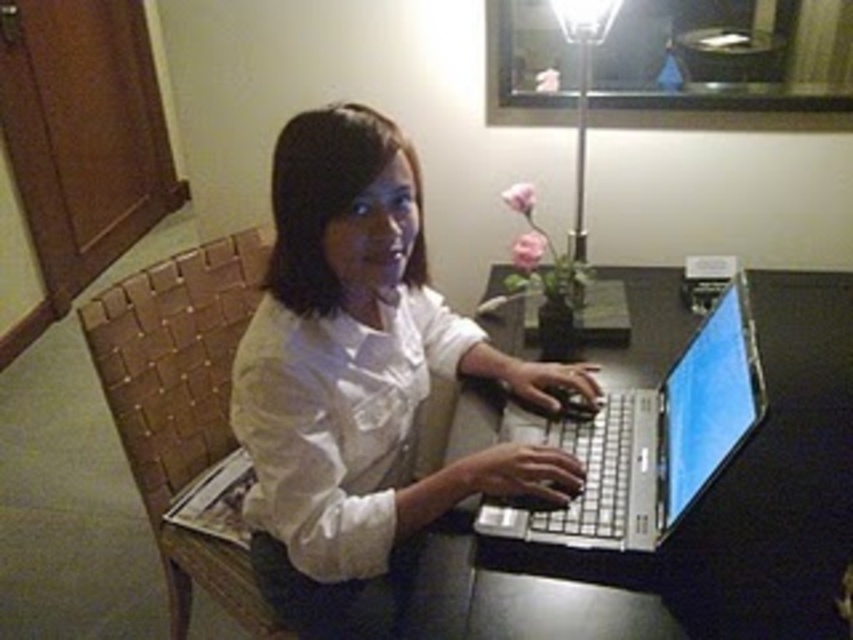
You are a person who wants to take a photo of the silver metallic laptop at center and the metallic silver lamp at upper center. Which object should you focus on first to ensure both are in frame?

You should focus on the metallic silver lamp at upper center first because the silver metallic laptop at center is in front of it, so adjusting the camera to include the lamp in the background will naturally include the laptop in the foreground.

You are a photographer setting up a shoot in this scene. You need to position a reflector to bounce light onto the white matte shirt at center without shining it on the metallic silver lamp at upper center. Where should you place the reflector relative to the shirt?

The white matte shirt at center is located below the metallic silver lamp at upper center. To bounce light onto the shirt without affecting the lamp, position the reflector below the shirt, angled upwards so the light reflects upward towards the shirt while avoiding the lamp above.

You are a delivery robot with a package that needs to be placed on the desk. The package is 16 inches wide. Can you place it between the white matte shirt at center and the metallic silver lamp at upper center without overlapping either?

The distance between the white matte shirt at center and the metallic silver lamp at upper center is 16.12 inches. Since the package is 16 inches wide, it can be placed between them without overlapping either object as there is sufficient space.